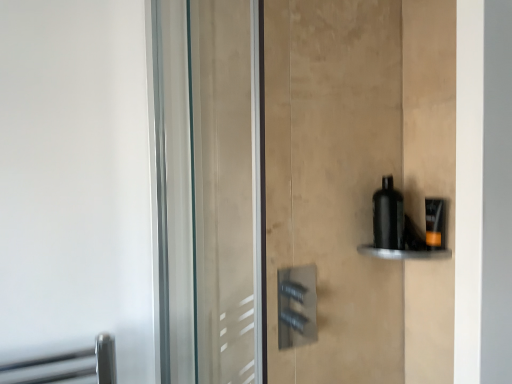
You are a GUI agent. You are given a task and a screenshot of the screen. Output one action in this format:
    pyautogui.click(x=<x>, y=<y>)
    Task: Click on the matte black bottle at right
    This screenshot has width=512, height=384.
    Given the screenshot: What is the action you would take?
    pyautogui.click(x=435, y=223)

Between matte black bottle at right and black glossy bottle at right, which one has larger size?

With larger size is black glossy bottle at right.

In the scene shown: Considering the positions of objects matte black bottle at right and black glossy bottle at right in the image provided, who is more to the right, matte black bottle at right or black glossy bottle at right?

matte black bottle at right.

How different are the orientations of matte black bottle at right and black glossy bottle at right in degrees?

106 degrees separate the facing orientations of matte black bottle at right and black glossy bottle at right.

Based on the photo, from a real-world perspective, which object stands above the other?

black matte bottle at right.

Is black matte bottle at right taller than matte black bottle at right?

Yes, black matte bottle at right is taller than matte black bottle at right.

Image resolution: width=512 pixels, height=384 pixels. Identify the location of toiletry that appears on the right of black matte bottle at right. (435, 223).

Who is smaller, black matte bottle at right or matte black bottle at right?

matte black bottle at right.

Between point (449, 253) and point (378, 229), which one is positioned in front?

The point (449, 253) is closer.

From the picture: Is black glossy bottle at right positioned in front of black matte bottle at right?

That is True.

Based on their positions, is black glossy bottle at right located to the left or right of black matte bottle at right?

Based on their positions, black glossy bottle at right is located to the right of black matte bottle at right.

Does black glossy bottle at right have a greater height compared to black matte bottle at right?

No.

Is point (429, 224) positioned in front of point (392, 180)?

Yes, it is in front of point (392, 180).

In terms of size, does matte black bottle at right appear bigger or smaller than black matte bottle at right?

matte black bottle at right is smaller than black matte bottle at right.

From a real-world perspective, who is located lower, matte black bottle at right or black matte bottle at right?

From a 3D spatial view, matte black bottle at right is below.

Would you say matte black bottle at right is a long distance from black matte bottle at right?

matte black bottle at right is near black matte bottle at right, not far away.

From the image's perspective, is black matte bottle at right on black glossy bottle at right?

Indeed, from the image's perspective, black matte bottle at right is shown above black glossy bottle at right.

Is point (376, 239) positioned in front of point (365, 248)?

Yes, point (376, 239) is in front of point (365, 248).

Which object is closer to the camera, black matte bottle at right or black glossy bottle at right?

black glossy bottle at right is closer to the camera.

Is black matte bottle at right bigger or smaller than black glossy bottle at right?

Clearly, black matte bottle at right is larger in size than black glossy bottle at right.

From the image's perspective, between black glossy bottle at right and matte black bottle at right, who is located below?

black glossy bottle at right.

Considering the relative sizes of black glossy bottle at right and matte black bottle at right in the image provided, is black glossy bottle at right bigger than matte black bottle at right?

Yes, black glossy bottle at right is bigger than matte black bottle at right.

Is black glossy bottle at right touching matte black bottle at right?

Yes, black glossy bottle at right is right next to matte black bottle at right and making contact.

Is black glossy bottle at right turned away from matte black bottle at right?

No, matte black bottle at right is not at the back of black glossy bottle at right.

You are a GUI agent. You are given a task and a screenshot of the screen. Output one action in this format:
    pyautogui.click(x=<x>, y=<y>)
    Task: Click on the shelf below the matte black bottle at right (from a real-world perspective)
    The image size is (512, 384).
    Given the screenshot: What is the action you would take?
    pyautogui.click(x=405, y=253)

In the image, there is a black matte bottle at right. At what (x,y) coordinates should I click in order to perform the action: click on toiletry below it (from the image's perspective). Please return your answer as a coordinate pair (x, y). Image resolution: width=512 pixels, height=384 pixels. Looking at the image, I should click on (435, 223).

Estimate the real-world distances between objects in this image. Which object is closer to black glossy bottle at right, black matte bottle at right or matte black bottle at right?

matte black bottle at right is positioned closer to the anchor black glossy bottle at right.

When comparing their distances from black matte bottle at right, does matte black bottle at right or black glossy bottle at right seem further?

matte black bottle at right lies further to black matte bottle at right than the other object.

Looking at this image, looking at the image, which one is located closer to matte black bottle at right, black matte bottle at right or black glossy bottle at right?

Among the two, black glossy bottle at right is located nearer to matte black bottle at right.

Considering their positions, is matte black bottle at right positioned further to black glossy bottle at right than black matte bottle at right?

Among the two, black matte bottle at right is located further to black glossy bottle at right.

Looking at the image, which one is located further to matte black bottle at right, black glossy bottle at right or black matte bottle at right?

Among the two, black matte bottle at right is located further to matte black bottle at right.

Based on their spatial positions, is black glossy bottle at right or matte black bottle at right closer to black matte bottle at right?

black glossy bottle at right is positioned closer to the anchor black matte bottle at right.

Find the location of `toiletry between black matte bottle at right and black glossy bottle at right in the vertical direction`. toiletry between black matte bottle at right and black glossy bottle at right in the vertical direction is located at coordinates (435, 223).